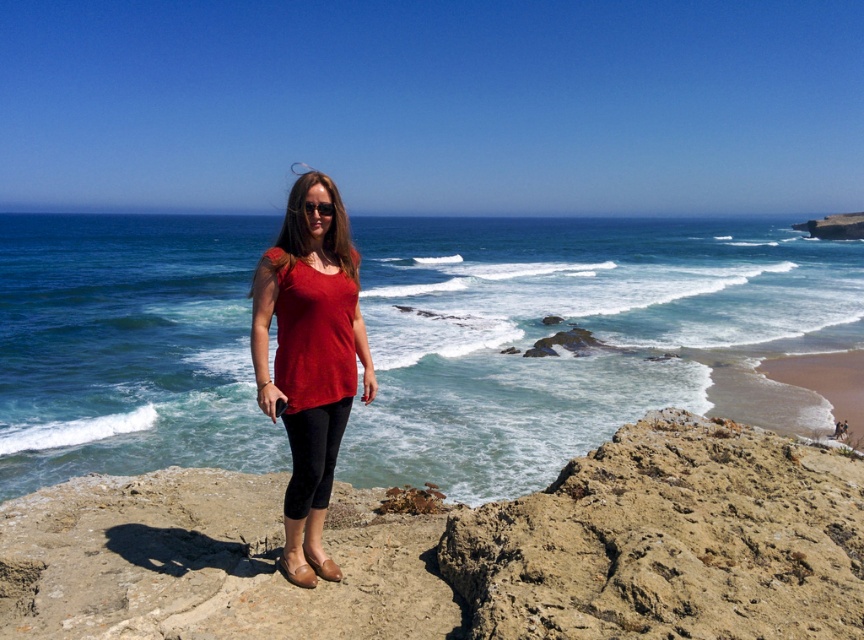
You are a photographer trying to capture the woman standing on the rocky outcrop. The point at coordinates (583, 326) is crucial for your composition. Where exactly is this point located in relation to the woman and the ocean?

The point at coordinates (583, 326) is on blue water at center, which means it is positioned in the middle of the ocean behind the woman, providing a central focal point for the composition.

You are a photographer planning to take a photo of the rough stone cliff at center and the matte red blouse at center. If your camera has a maximum focus range of 5 feet, will both objects be in focus at the same time?

The rough stone cliff at center and matte red blouse at center are 4.56 feet apart from each other, so both objects will be in focus at the same time since the distance between them is within the camera maximum focus range of 5 feet.

You are standing on the rocky outcrop and want to take a photo of the blue water at center and the rough stone cliff at center. Which object should you focus on first if you want both to be in sharp focus?

You should focus on the rough stone cliff at center first because it is closer to you than the blue water at center, which is further away. This way, both objects will be in sharp focus.